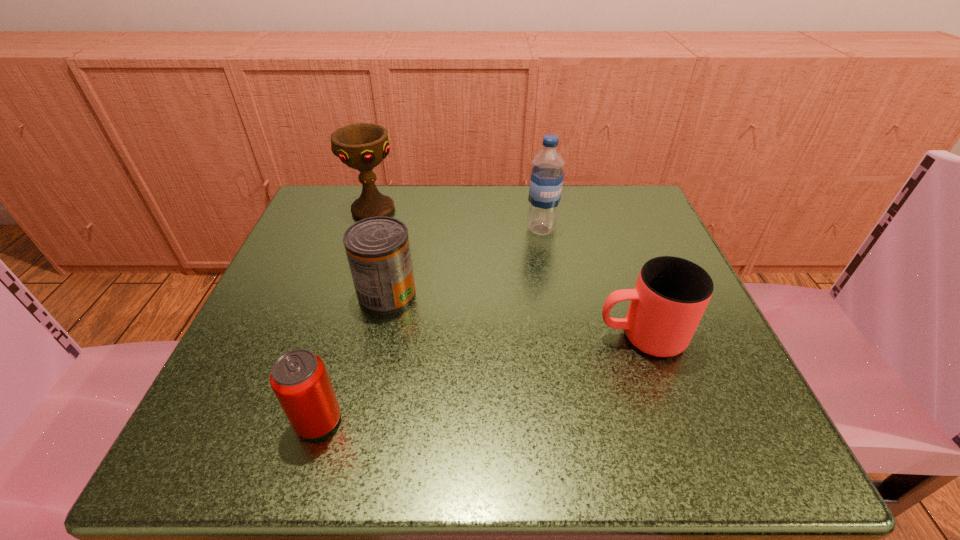
Find the location of a particular element. vacant space situated on the handle side of the rightmost object is located at coordinates (527, 336).

Identify the location of vacant region located 0.160m on the back of the nearer can. The width and height of the screenshot is (960, 540). (349, 317).

You are a GUI agent. You are given a task and a screenshot of the screen. Output one action in this format:
    pyautogui.click(x=<x>, y=<y>)
    Task: Click on the water bottle that is at the far edge
    This screenshot has width=960, height=540.
    Given the screenshot: What is the action you would take?
    pyautogui.click(x=547, y=175)

You are a GUI agent. You are given a task and a screenshot of the screen. Output one action in this format:
    pyautogui.click(x=<x>, y=<y>)
    Task: Click on the chalice at the far edge
    This screenshot has width=960, height=540.
    Given the screenshot: What is the action you would take?
    pyautogui.click(x=362, y=146)

This screenshot has height=540, width=960. Identify the location of object that is positioned at the near edge. (299, 379).

The image size is (960, 540). In order to click on chalice that is at the left edge in this screenshot , I will do `click(362, 146)`.

Locate an element on the screen. can located in the left edge section of the desktop is located at coordinates (299, 379).

Where is `object present at the right edge`? The height and width of the screenshot is (540, 960). object present at the right edge is located at coordinates (671, 294).

Identify the location of object that is at the far left corner. The height and width of the screenshot is (540, 960). (362, 146).

Find the location of `object that is at the near left corner`. object that is at the near left corner is located at coordinates (299, 379).